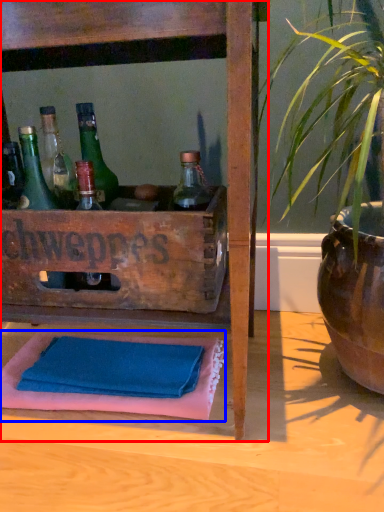
Question: Which object appears closest to the camera in this image, furniture (highlighted by a red box) or bath towel (highlighted by a blue box)?

Choices:
 (A) furniture
 (B) bath towel

Answer: (A)